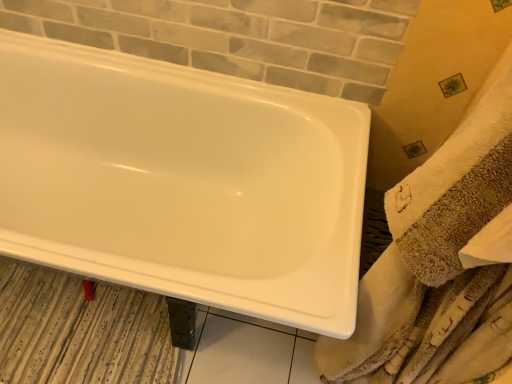
Identify the location of free point above striped fabric bath mat at lower left (from a real-world perspective). (84, 333).